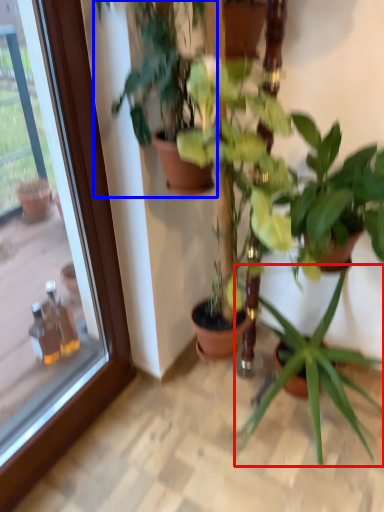
Question: Among these objects, which one is farthest to the camera, houseplant (highlighted by a red box) or houseplant (highlighted by a blue box)?

Choices:
 (A) houseplant
 (B) houseplant

Answer: (A)